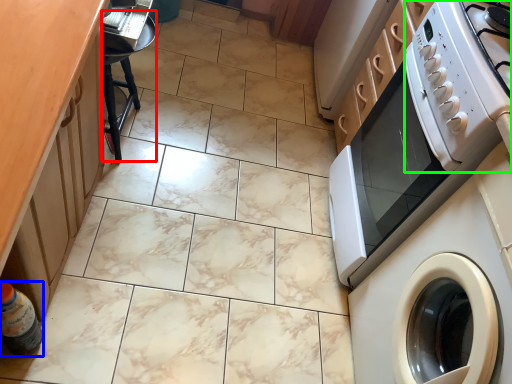
Question: Which object is the farthest from bar stool (highlighted by a red box)? Choose among these: bottle (highlighted by a blue box) or appliance (highlighted by a green box).

Choices:
 (A) bottle
 (B) appliance

Answer: (B)